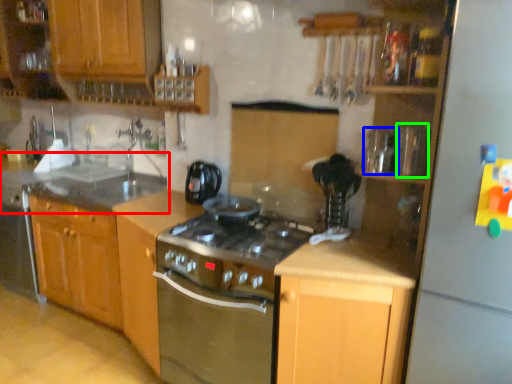
Question: Which is nearer to the countertop (highlighted by a red box)? appliance (highlighted by a blue box) or appliance (highlighted by a green box).

Choices:
 (A) appliance
 (B) appliance

Answer: (A)